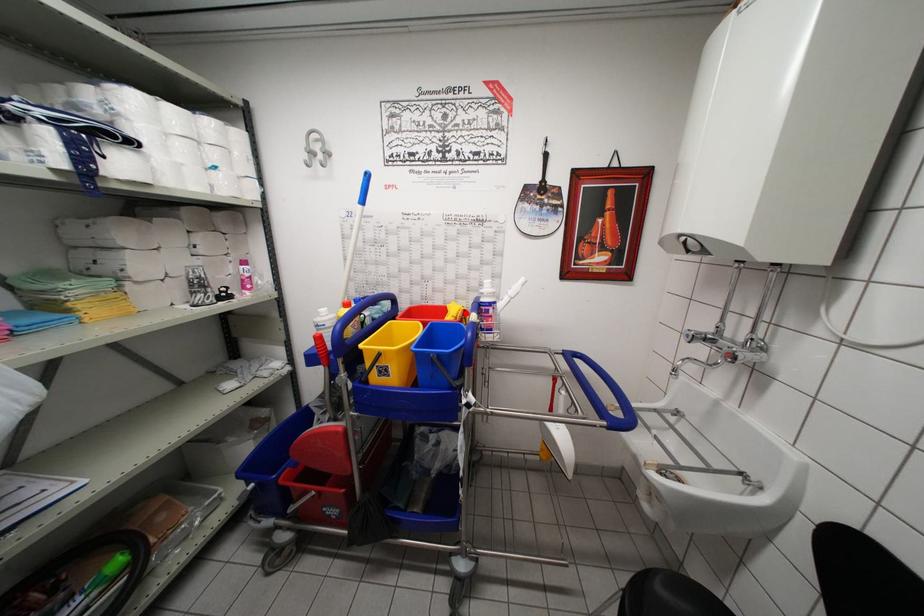
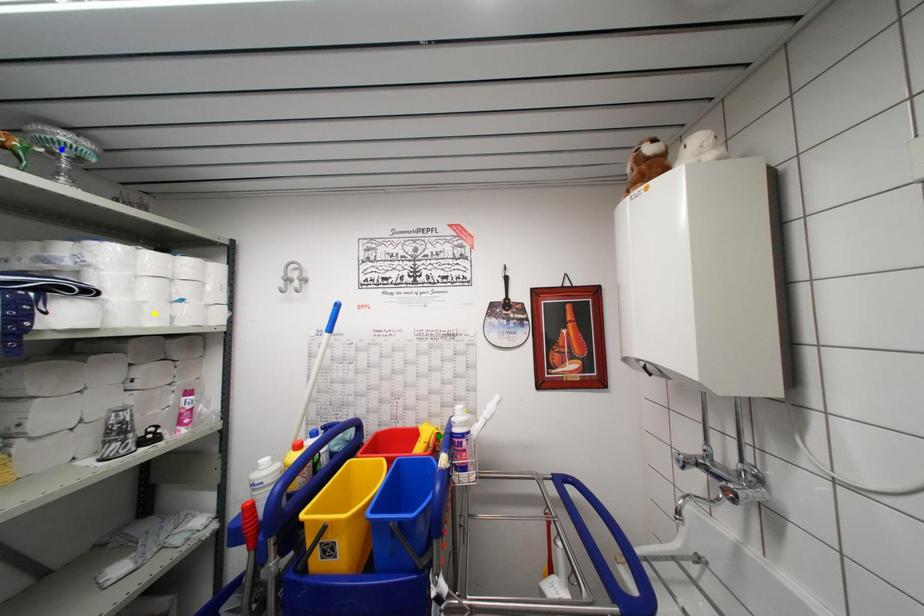
Question: I am providing you with two images of the same scene from different viewpoints. A red point is marked on the first image. You are given multiple points on the second image. Which point in image 2 is actually the same real-world point as the red point in image 1?

Choices:
 (A) blue point
 (B) yellow point
 (C) green point

Answer: (C)